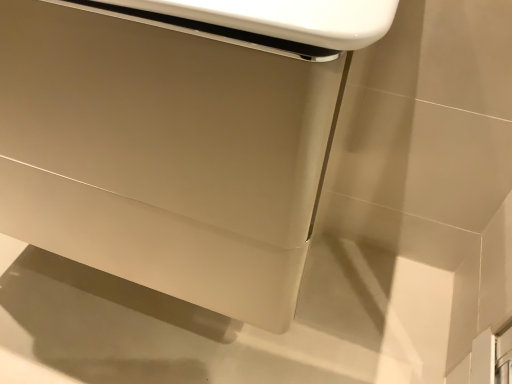
Question: Should I look upward or downward to see matte white cabinet at center?

Choices:
 (A) up
 (B) down

Answer: (A)